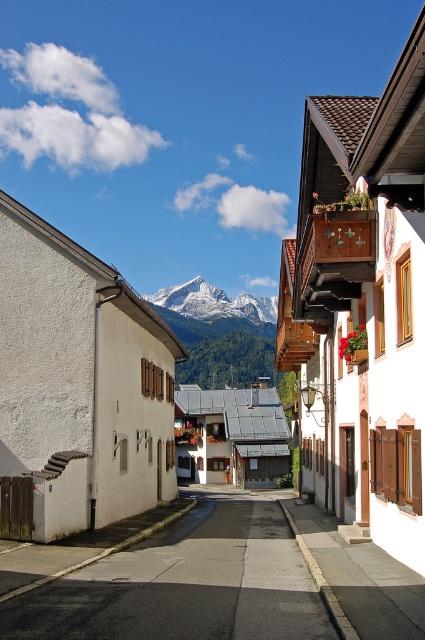
Is the position of smooth asphalt road at center more distant than that of white snow-covered mountain at center?

No, it is in front of white snow-covered mountain at center.

What are the coordinates of `smooth asphalt road at center` in the screenshot? It's located at (186, 584).